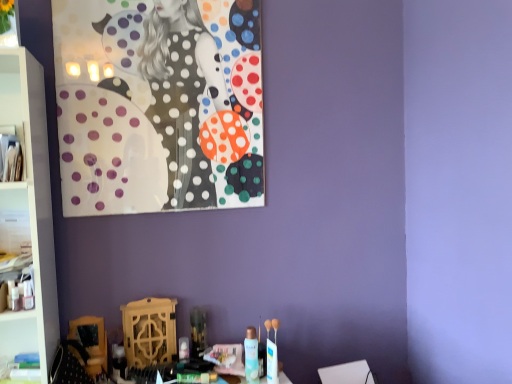
Question: Is translucent plastic spray can at center taller than translucent plastic bottle at lower center?

Choices:
 (A) yes
 (B) no

Answer: (A)

Question: Is translucent plastic spray can at center not near translucent plastic bottle at lower center?

Choices:
 (A) yes
 (B) no

Answer: (B)

Question: Does translucent plastic spray can at center appear on the right side of translucent plastic bottle at lower center?

Choices:
 (A) no
 (B) yes

Answer: (A)

Question: Is translucent plastic bottle at lower center located within translucent plastic spray can at center?

Choices:
 (A) no
 (B) yes

Answer: (A)

Question: Can you confirm if translucent plastic spray can at center is thinner than translucent plastic bottle at lower center?

Choices:
 (A) no
 (B) yes

Answer: (B)

Question: From a real-world perspective, is translucent plastic spray can at center physically above translucent plastic bottle at lower center?

Choices:
 (A) yes
 (B) no

Answer: (A)

Question: Would you say polished glass painting at upper left contains white plastic cabinet at left, which is the 2th cabinet from bottom to top?

Choices:
 (A) yes
 (B) no

Answer: (B)

Question: Is polished glass painting at upper left outside white plastic cabinet at left, marked as the first cabinet in a top-to-bottom arrangement?

Choices:
 (A) yes
 (B) no

Answer: (A)

Question: From a real-world perspective, is polished glass painting at upper left physically above white plastic cabinet at left, marked as the first cabinet in a top-to-bottom arrangement?

Choices:
 (A) no
 (B) yes

Answer: (B)

Question: From a real-world perspective, is polished glass painting at upper left under white plastic cabinet at left, which is the 2th cabinet from bottom to top?

Choices:
 (A) no
 (B) yes

Answer: (A)

Question: Is polished glass painting at upper left positioned in front of white plastic cabinet at left, which is the 2th cabinet from bottom to top?

Choices:
 (A) yes
 (B) no

Answer: (B)

Question: Considering the relative sizes of polished glass painting at upper left and white plastic cabinet at left, which ranks as the 2th cabinet in back-to-front order, in the image provided, is polished glass painting at upper left shorter than white plastic cabinet at left, which ranks as the 2th cabinet in back-to-front order,?

Choices:
 (A) no
 (B) yes

Answer: (A)

Question: Is polished glass painting at upper left closer to the viewer compared to translucent plastic spray can at center?

Choices:
 (A) no
 (B) yes

Answer: (A)